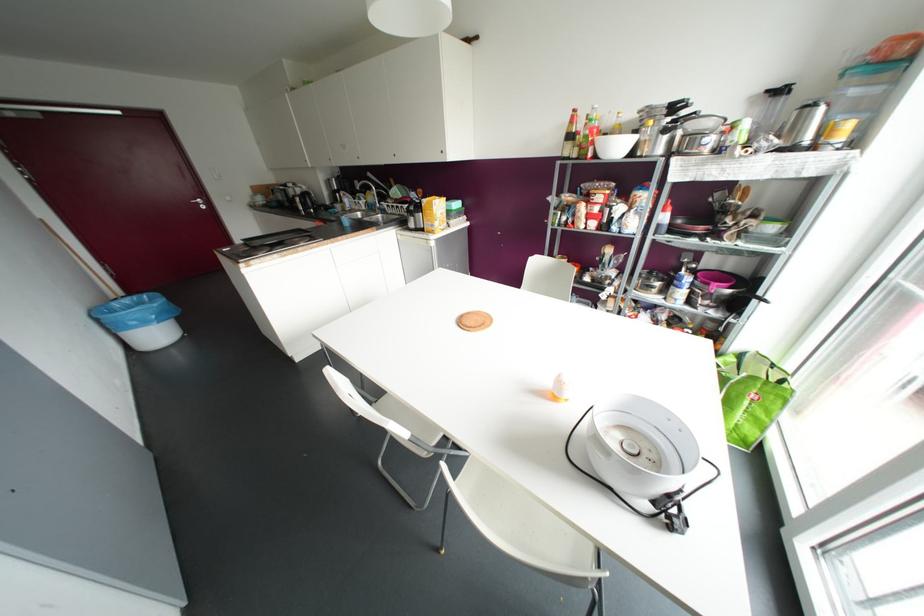
Find where to turn the silver door handle. Please return your answer as a coordinate pair (x, y).

(199, 201)